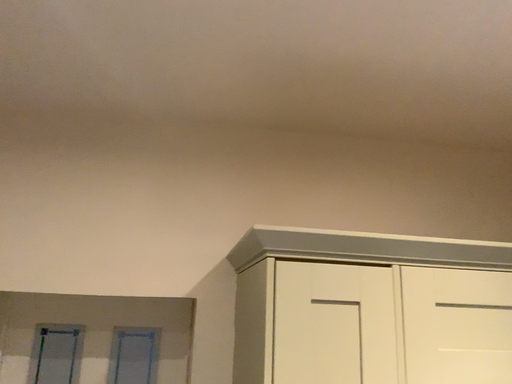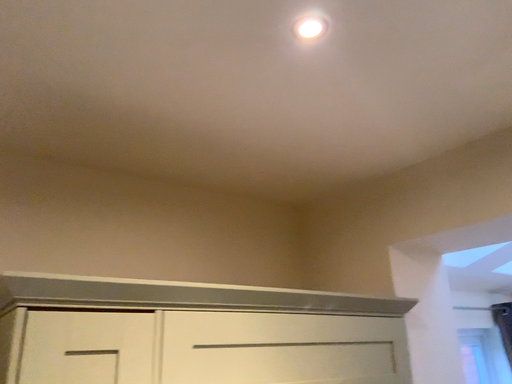
Question: How did the camera likely rotate when shooting the video?

Choices:
 (A) rotated left
 (B) rotated right

Answer: (B)